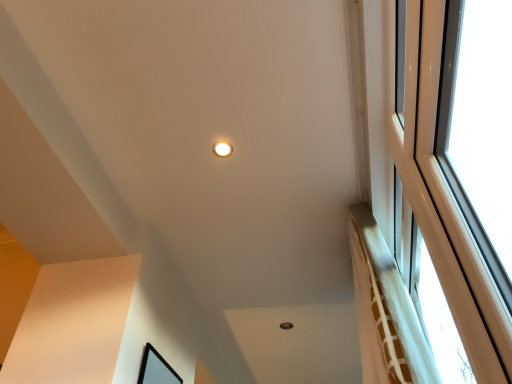
Question: Is matte white light fixture at upper center inside black matte picture frame at lower left?

Choices:
 (A) yes
 (B) no

Answer: (B)

Question: Is black matte picture frame at lower left to the right of matte white light fixture at upper center from the viewer's perspective?

Choices:
 (A) yes
 (B) no

Answer: (B)

Question: Does black matte picture frame at lower left turn towards matte white light fixture at upper center?

Choices:
 (A) no
 (B) yes

Answer: (A)

Question: Are black matte picture frame at lower left and matte white light fixture at upper center located far from each other?

Choices:
 (A) yes
 (B) no

Answer: (B)

Question: Is black matte picture frame at lower left with matte white light fixture at upper center?

Choices:
 (A) no
 (B) yes

Answer: (A)

Question: Can you confirm if black matte picture frame at lower left is wider than matte white light fixture at upper center?

Choices:
 (A) yes
 (B) no

Answer: (B)

Question: Is matte white light fixture at upper center turned away from black matte picture frame at lower left?

Choices:
 (A) no
 (B) yes

Answer: (A)

Question: Is matte white light fixture at upper center to the left of black matte picture frame at lower left from the viewer's perspective?

Choices:
 (A) yes
 (B) no

Answer: (B)

Question: Can you confirm if matte white light fixture at upper center is positioned to the right of black matte picture frame at lower left?

Choices:
 (A) yes
 (B) no

Answer: (A)

Question: Can you confirm if matte white light fixture at upper center is taller than black matte picture frame at lower left?

Choices:
 (A) no
 (B) yes

Answer: (A)

Question: Is matte white light fixture at upper center positioned in front of black matte picture frame at lower left?

Choices:
 (A) yes
 (B) no

Answer: (B)

Question: Can you confirm if matte white light fixture at upper center is bigger than black matte picture frame at lower left?

Choices:
 (A) yes
 (B) no

Answer: (B)

Question: Would you say matte white light fixture at upper center is to the left or to the right of black matte picture frame at lower left in the picture?

Choices:
 (A) left
 (B) right

Answer: (B)